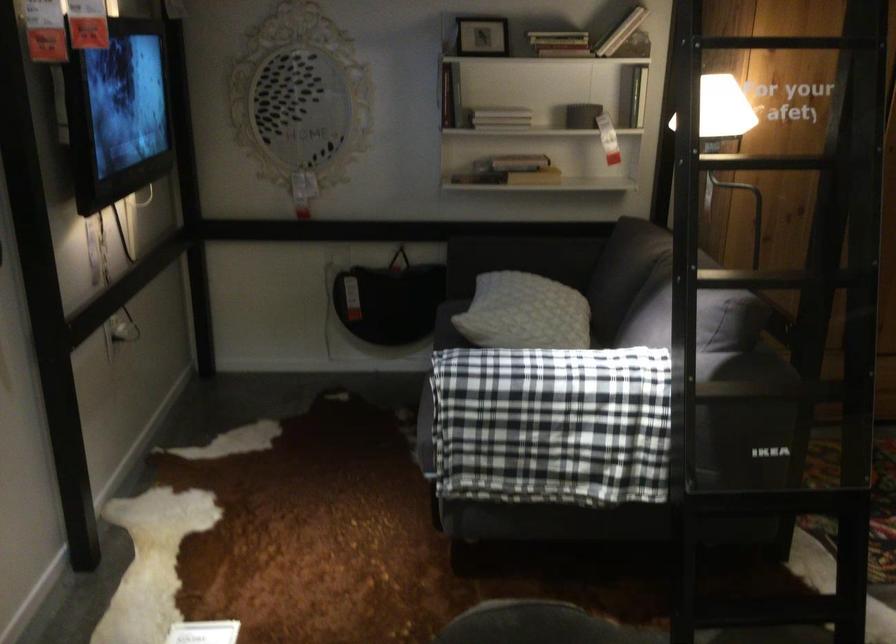
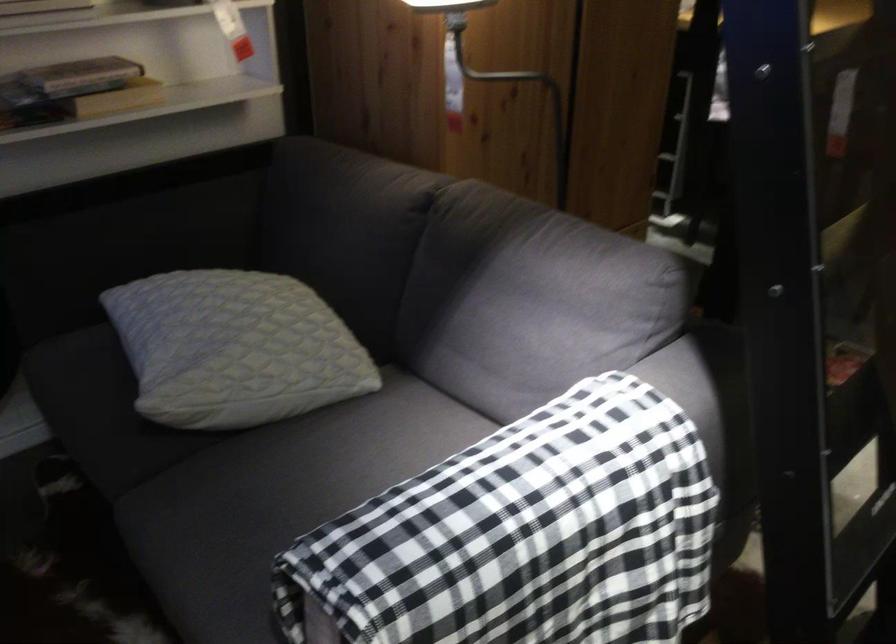
Find the pixel in the second image that matches the point at 451,346 in the first image.

(131, 448)